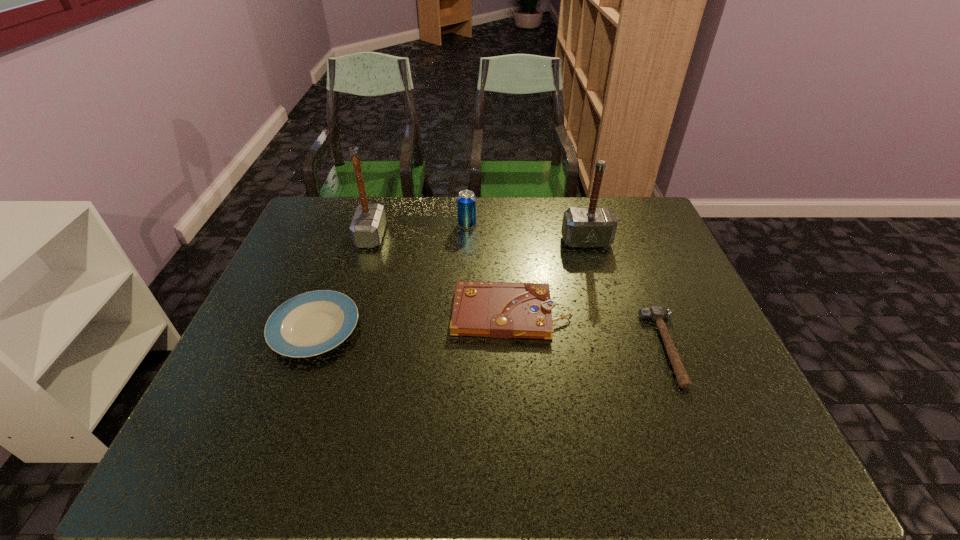
Locate an element on the screen. vacant point located between the second hammer from left to right and the third shortest object is located at coordinates pos(548,277).

The height and width of the screenshot is (540, 960). In order to click on free space between the notebook and the plate in this screenshot , I will do `click(413, 321)`.

Locate an element on the screen. Image resolution: width=960 pixels, height=540 pixels. vacant area between the beer can and the shortest hammer is located at coordinates (566, 286).

Find the location of a particular element. The image size is (960, 540). vacant area that lies between the plate and the fourth shortest object is located at coordinates (391, 276).

Find the location of a particular element. the second closest object to the leftmost hammer is located at coordinates (466, 201).

Identify which object is the fifth nearest to the fourth shortest object. Please provide its 2D coordinates. Your answer should be formatted as a tuple, i.e. [(x, y)], where the tuple contains the x and y coordinates of a point satisfying the conditions above.

[(656, 313)]

Find the location of `hammer that is the second closest to the leftmost hammer`. hammer that is the second closest to the leftmost hammer is located at coordinates (656, 313).

In order to click on hammer that can be found as the second closest to the plate in this screenshot , I will do `click(592, 227)`.

Identify the location of free space that satisfies the following two spatial constraints: 1. on the striking surface of the leftmost hammer; 2. on the right side of the fourth tallest object. The image size is (960, 540). (348, 313).

The width and height of the screenshot is (960, 540). Find the location of `free space that satisfies the following two spatial constraints: 1. on the striking surface of the leftmost hammer; 2. on the back side of the fifth object from left to right`. free space that satisfies the following two spatial constraints: 1. on the striking surface of the leftmost hammer; 2. on the back side of the fifth object from left to right is located at coordinates (370, 241).